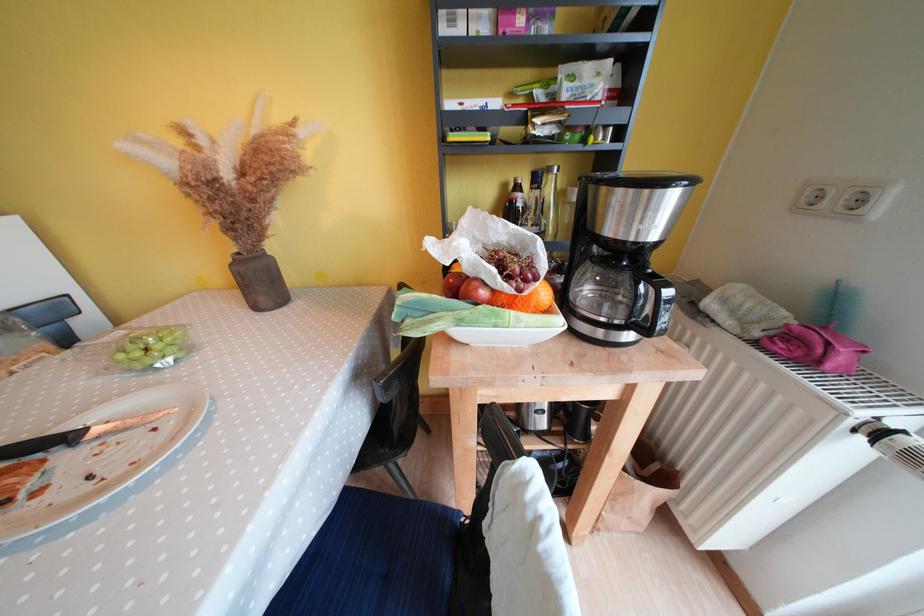
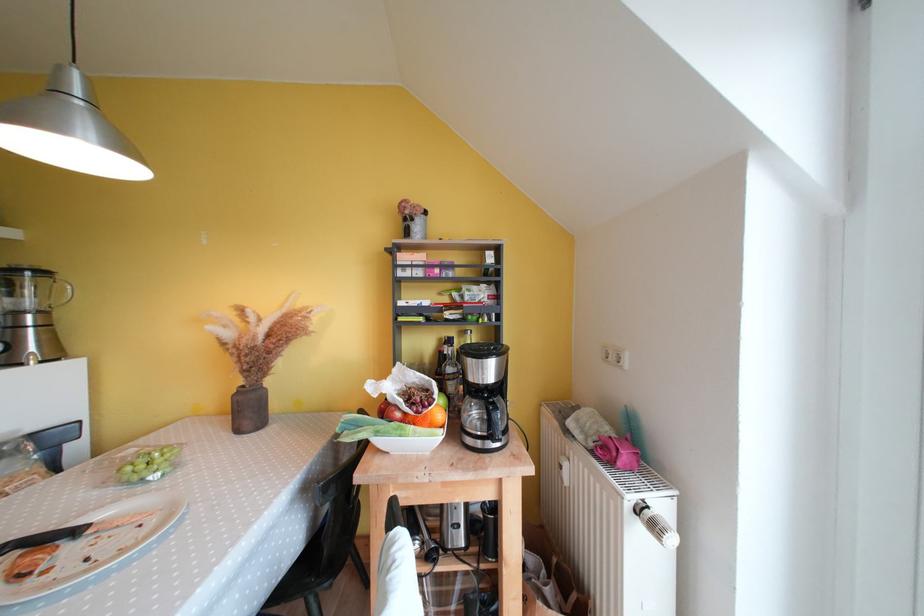
Where in the second image is the point corresponding to [269,290] from the first image?

(256, 416)